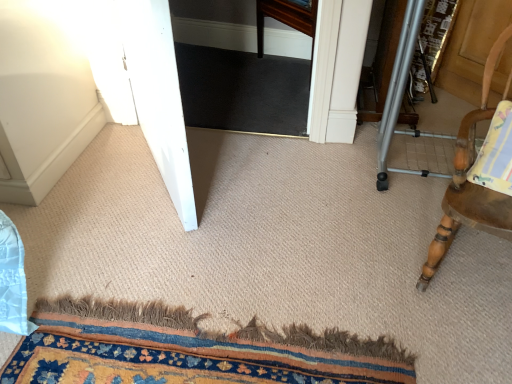
What do you see at coordinates (189, 349) in the screenshot? The image size is (512, 384). I see `carpeted mat at lower center` at bounding box center [189, 349].

The height and width of the screenshot is (384, 512). Find the location of `wooden chair with striped cushion at right`. wooden chair with striped cushion at right is located at coordinates (470, 183).

Identify the location of white glossy screen door at left. The width and height of the screenshot is (512, 384). (159, 97).

What do you see at coordinates (159, 97) in the screenshot? I see `white glossy screen door at left` at bounding box center [159, 97].

The width and height of the screenshot is (512, 384). I want to click on carpeted mat at lower center, so click(189, 349).

Based on their positions, is carpeted mat at lower center located to the left or right of white glossy screen door at left?

Based on their positions, carpeted mat at lower center is located to the right of white glossy screen door at left.

Can you confirm if carpeted mat at lower center is wider than white glossy screen door at left?

Correct, the width of carpeted mat at lower center exceeds that of white glossy screen door at left.

Looking at this image, how different are the orientations of carpeted mat at lower center and white glossy screen door at left in degrees?

They differ by 32.4 degrees in their facing directions.

Considering the points (152, 371) and (130, 0), which point is behind, point (152, 371) or point (130, 0)?

The point (130, 0) is farther from the camera.

From a real-world perspective, is carpeted mat at lower center positioned over wooden chair with striped cushion at right based on gravity?

Incorrect, from a real-world perspective, carpeted mat at lower center is lower than wooden chair with striped cushion at right.

Is wooden chair with striped cushion at right inside carpeted mat at lower center?

Definitely not — wooden chair with striped cushion at right is not inside carpeted mat at lower center.

How different are the orientations of carpeted mat at lower center and wooden chair with striped cushion at right in degrees?

107 degrees separate the facing orientations of carpeted mat at lower center and wooden chair with striped cushion at right.

From the image's perspective, which one is positioned higher, wooden chair with striped cushion at right or carpeted mat at lower center?

wooden chair with striped cushion at right.

Is wooden chair with striped cushion at right turned away from carpeted mat at lower center?

No, wooden chair with striped cushion at right is not facing the opposite direction of carpeted mat at lower center.

Which is more to the left, wooden chair with striped cushion at right or carpeted mat at lower center?

Positioned to the left is carpeted mat at lower center.

Does wooden chair with striped cushion at right appear on the right side of white glossy screen door at left?

Yes, wooden chair with striped cushion at right is to the right of white glossy screen door at left.

Considering the relative sizes of wooden chair with striped cushion at right and white glossy screen door at left in the image provided, is wooden chair with striped cushion at right shorter than white glossy screen door at left?

Yes.

What's the angular difference between wooden chair with striped cushion at right and white glossy screen door at left's facing directions?

The facing directions of wooden chair with striped cushion at right and white glossy screen door at left are 140 degrees apart.

Considering the relative sizes of white glossy screen door at left and wooden chair with striped cushion at right in the image provided, is white glossy screen door at left smaller than wooden chair with striped cushion at right?

No.

Considering the positions of objects white glossy screen door at left and wooden chair with striped cushion at right in the image provided, who is more to the right, white glossy screen door at left or wooden chair with striped cushion at right?

From the viewer's perspective, wooden chair with striped cushion at right appears more on the right side.

Looking at their sizes, would you say white glossy screen door at left is wider or thinner than wooden chair with striped cushion at right?

In the image, white glossy screen door at left appears to be more narrow than wooden chair with striped cushion at right.

Which is nearer, (167, 17) or (379, 373)?

The point (167, 17) is in front.

Which is behind, white glossy screen door at left or carpeted mat at lower center?

white glossy screen door at left.

From a real-world perspective, is white glossy screen door at left on carpeted mat at lower center?

Yes, from a real-world perspective, white glossy screen door at left is above carpeted mat at lower center.

This screenshot has height=384, width=512. In order to click on screen door lying above the carpeted mat at lower center (from the image's perspective) in this screenshot , I will do `click(159, 97)`.

Find the location of a particular element. Image resolution: width=512 pixels, height=384 pixels. chair in front of the carpeted mat at lower center is located at coordinates (470, 183).

Estimate the real-world distances between objects in this image. Which object is closer to carpeted mat at lower center, white glossy screen door at left or wooden chair with striped cushion at right?

Among the two, wooden chair with striped cushion at right is located nearer to carpeted mat at lower center.

Based on their spatial positions, is wooden chair with striped cushion at right or carpeted mat at lower center closer to white glossy screen door at left?

carpeted mat at lower center is positioned closer to the anchor white glossy screen door at left.

Estimate the real-world distances between objects in this image. Which object is closer to wooden chair with striped cushion at right, white glossy screen door at left or carpeted mat at lower center?

Among the two, carpeted mat at lower center is located nearer to wooden chair with striped cushion at right.

Looking at this image, looking at the image, which one is located closer to wooden chair with striped cushion at right, carpeted mat at lower center or white glossy screen door at left?

Based on the image, carpeted mat at lower center appears to be nearer to wooden chair with striped cushion at right.

From the image, which object appears to be farther from white glossy screen door at left, carpeted mat at lower center or wooden chair with striped cushion at right?

wooden chair with striped cushion at right is positioned further to the anchor white glossy screen door at left.

Looking at the image, which one is located further to carpeted mat at lower center, wooden chair with striped cushion at right or white glossy screen door at left?

white glossy screen door at left is further to carpeted mat at lower center.

The width and height of the screenshot is (512, 384). Identify the location of mat situated between white glossy screen door at left and wooden chair with striped cushion at right from left to right. (189, 349).